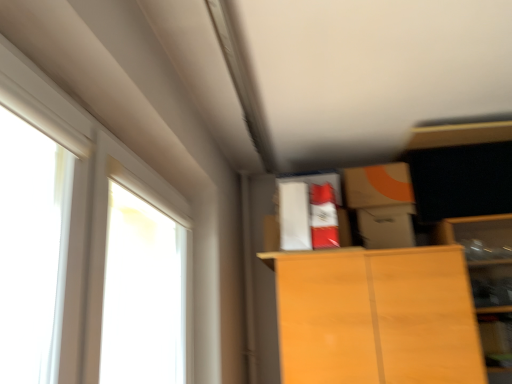
Question: Is white glossy window at upper left, the second window viewed from the front, further to camera compared to white glossy window at left, arranged as the second window when viewed from the back?

Choices:
 (A) no
 (B) yes

Answer: (B)

Question: Can you confirm if white glossy window at upper left, the second window viewed from the front, is bigger than white glossy window at left, arranged as the second window when viewed from the back?

Choices:
 (A) no
 (B) yes

Answer: (B)

Question: Can you confirm if white glossy window at upper left, the 1th window from the back, is taller than white glossy window at left, arranged as the second window when viewed from the back?

Choices:
 (A) no
 (B) yes

Answer: (B)

Question: Considering the relative sizes of white glossy window at upper left, the 1th window from the back, and white glossy window at left, the first window viewed from the front, in the image provided, is white glossy window at upper left, the 1th window from the back, thinner than white glossy window at left, the first window viewed from the front,?

Choices:
 (A) no
 (B) yes

Answer: (A)

Question: Does white glossy window at upper left, the second window viewed from the front, appear on the right side of white glossy window at left, arranged as the second window when viewed from the back?

Choices:
 (A) yes
 (B) no

Answer: (A)

Question: From the image's perspective, does white glossy window at upper left, the second window viewed from the front, appear higher than white glossy window at left, the first window viewed from the front?

Choices:
 (A) yes
 (B) no

Answer: (B)

Question: Is white glossy window at left, the first window viewed from the front, closer to the viewer compared to white glossy window at upper left, the 1th window from the back?

Choices:
 (A) yes
 (B) no

Answer: (A)

Question: Considering the relative sizes of white glossy window at left, arranged as the second window when viewed from the back, and white glossy window at upper left, the 1th window from the back, in the image provided, is white glossy window at left, arranged as the second window when viewed from the back, taller than white glossy window at upper left, the 1th window from the back,?

Choices:
 (A) no
 (B) yes

Answer: (A)

Question: From a real-world perspective, is white glossy window at left, the first window viewed from the front, physically below white glossy window at upper left, the 1th window from the back?

Choices:
 (A) yes
 (B) no

Answer: (B)

Question: Can you confirm if white glossy window at left, arranged as the second window when viewed from the back, is positioned to the left of white glossy window at upper left, the second window viewed from the front?

Choices:
 (A) no
 (B) yes

Answer: (B)

Question: Considering the relative sizes of white glossy window at left, arranged as the second window when viewed from the back, and white glossy window at upper left, the 1th window from the back, in the image provided, is white glossy window at left, arranged as the second window when viewed from the back, shorter than white glossy window at upper left, the 1th window from the back,?

Choices:
 (A) no
 (B) yes

Answer: (B)

Question: From a real-world perspective, is white glossy window at left, the first window viewed from the front, positioned above or below white glossy window at upper left, the 1th window from the back?

Choices:
 (A) above
 (B) below

Answer: (A)